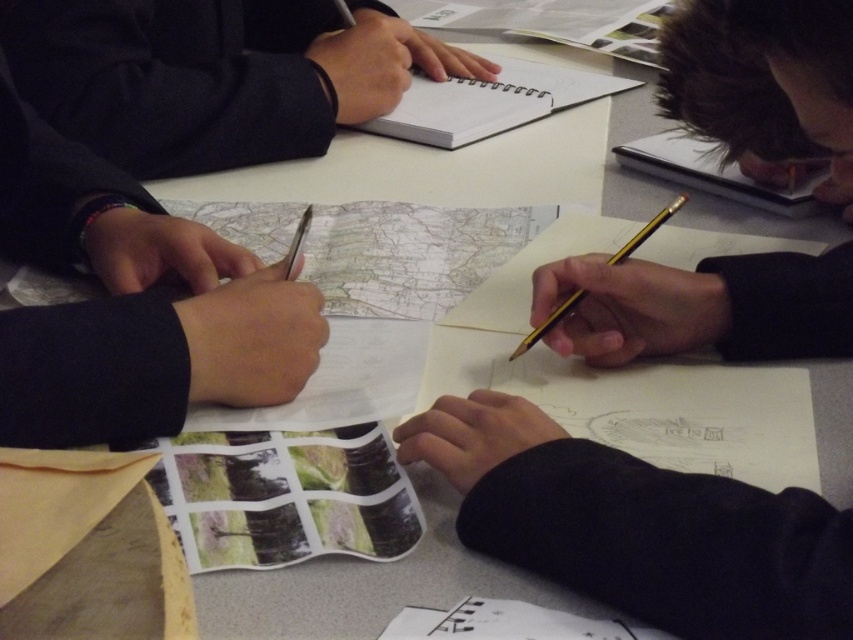
Question: Which object is closer to the camera taking this photo?

Choices:
 (A) matte black notebook at upper left
 (B) dark brown hair at upper right
 (C) gold metallic pencil at center
 (D) black matte pen at left

Answer: (B)

Question: Is the position of matte black notebook at upper left less distant than that of dark brown hair at upper right?

Choices:
 (A) yes
 (B) no

Answer: (B)

Question: Estimate the real-world distances between objects in this image. Which object is farther from the gold metallic pencil at center?

Choices:
 (A) matte black notebook at upper left
 (B) dark brown hair at upper right
 (C) black matte pen at left

Answer: (A)

Question: Is matte black notebook at upper left thinner than dark brown hair at upper right?

Choices:
 (A) no
 (B) yes

Answer: (A)

Question: Is black matte pen at left below dark brown hair at upper right?

Choices:
 (A) no
 (B) yes

Answer: (B)

Question: Which of these objects is positioned closest to the gold metallic pencil at center?

Choices:
 (A) black matte pen at left
 (B) dark brown hair at upper right

Answer: (B)